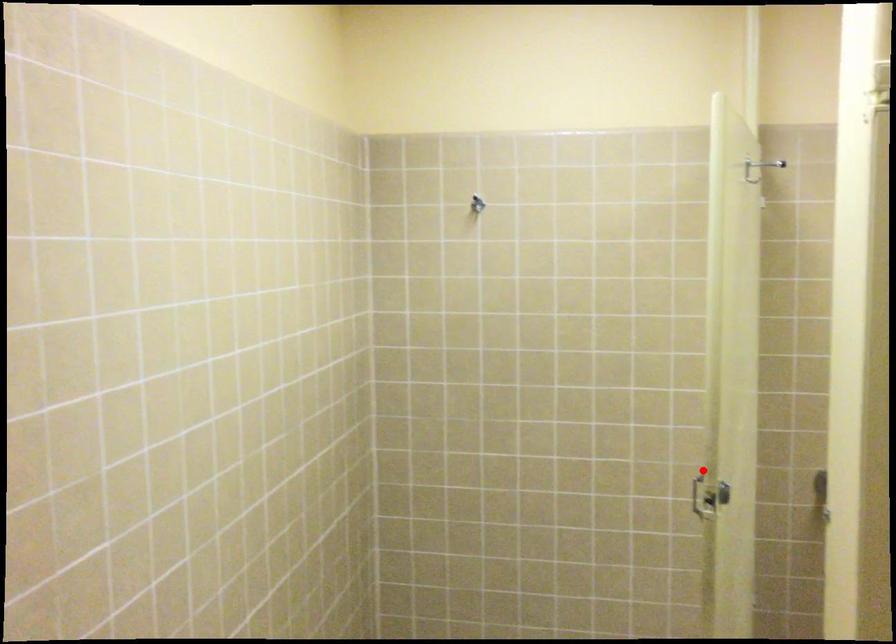
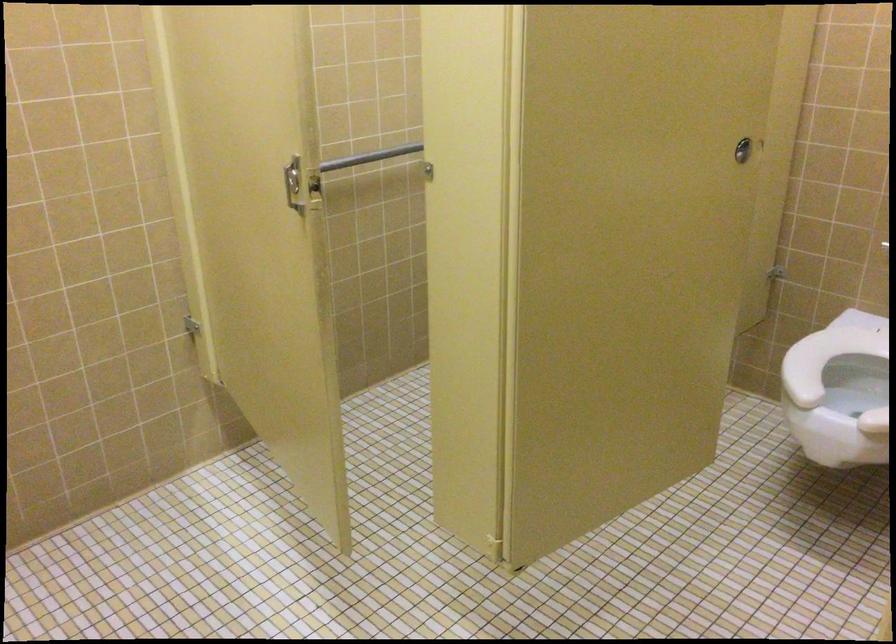
Find the pixel in the second image that matches the highlighted location in the first image.

(293, 184)